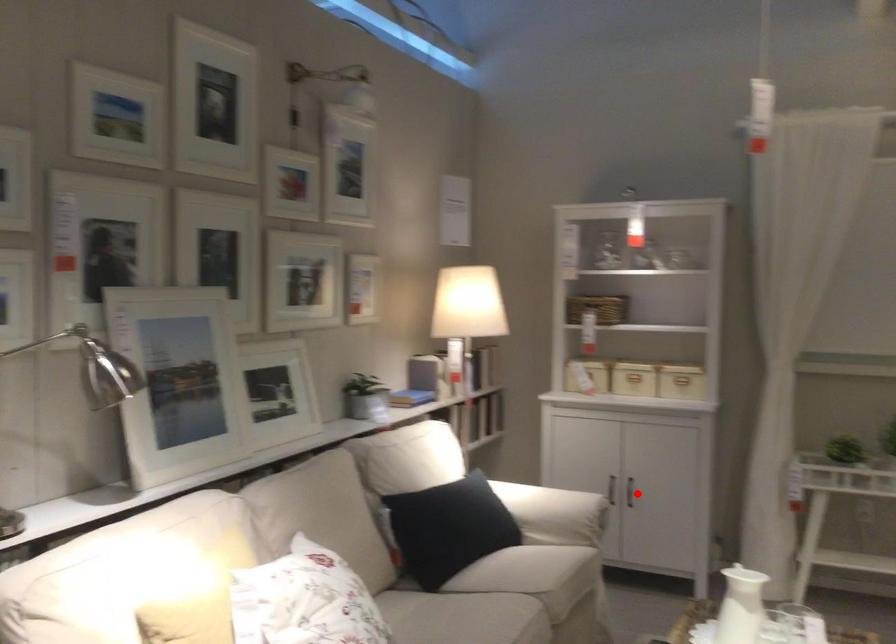
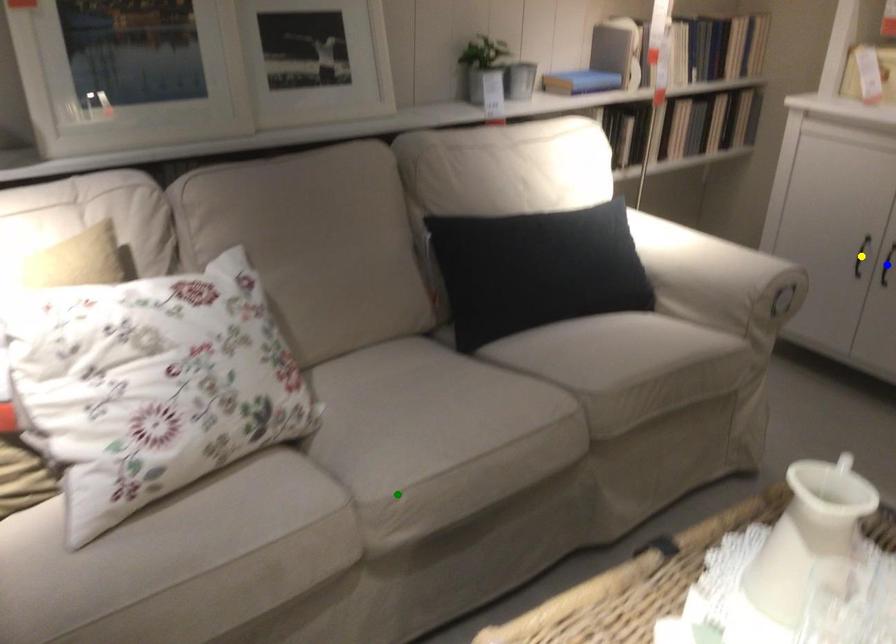
Question: I am providing you with two images of the same scene from different viewpoints. A red point is marked on the first image. You are given multiple points on the second image. Which spot in image 2 lines up with the point in image 1?

Choices:
 (A) blue point
 (B) green point
 (C) yellow point

Answer: (A)